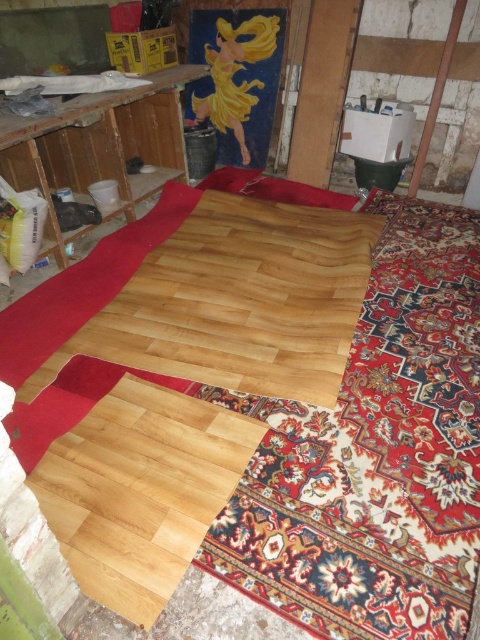
You are a contractor assessing the renovation progress. You notice two sections of natural wood floor at center and natural wood flooring at center. Which section is wider?

The natural wood floor at center is wider than the natural wood flooring at center.

You are a contractor working on this renovation project. You need to determine the order in which the natural wood floor at center and the natural wood flooring at center were installed. Based on their positions, which one was installed first?

The natural wood floor at center was installed first because it is positioned under the natural wood flooring at center, indicating it was laid down before the latter was placed on top.